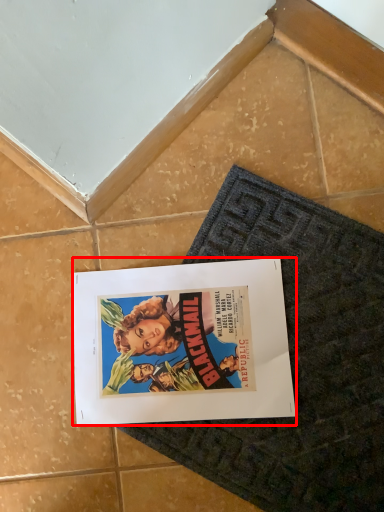
Question: From the image's perspective, where is poster (annotated by the red box) located relative to bath mat?

Choices:
 (A) below
 (B) above

Answer: (B)